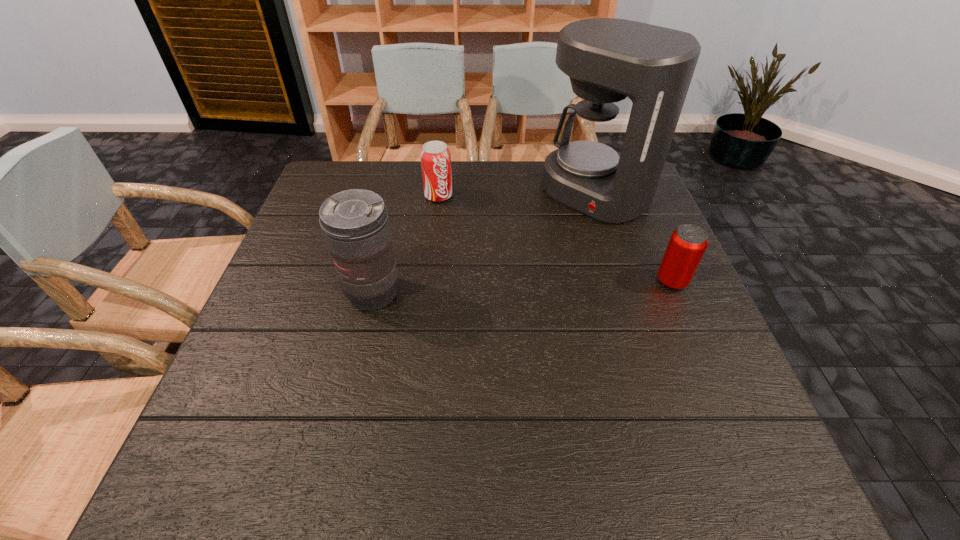
You are a GUI agent. You are given a task and a screenshot of the screen. Output one action in this format:
    pyautogui.click(x=<x>, y=<y>)
    Task: Click on the free space between the telephoto lens and the tallest object
    The height and width of the screenshot is (540, 960).
    Given the screenshot: What is the action you would take?
    pyautogui.click(x=485, y=244)

Locate an element on the screen. The height and width of the screenshot is (540, 960). free spot between the can and the telephoto lens is located at coordinates (522, 287).

Find the location of a particular element. The image size is (960, 540). empty location between the can and the telephoto lens is located at coordinates (522, 287).

Find the location of a particular element. vacant point located between the second tallest object and the can is located at coordinates (522, 287).

This screenshot has height=540, width=960. Identify the location of the closest object relative to the second tallest object. (435, 156).

I want to click on object that ranks as the second closest to the soda can, so click(355, 224).

You are a GUI agent. You are given a task and a screenshot of the screen. Output one action in this format:
    pyautogui.click(x=<x>, y=<y>)
    Task: Click on the free spot that satisfies the following two spatial constraints: 1. on the back side of the tallest object; 2. on the right side of the soda can
    The width and height of the screenshot is (960, 540).
    Given the screenshot: What is the action you would take?
    pyautogui.click(x=439, y=193)